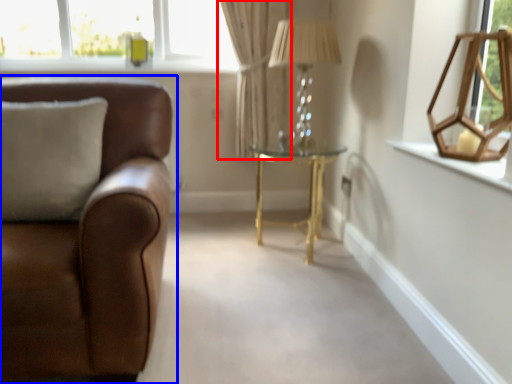
Question: Which object appears closest to the camera in this image, curtain (highlighted by a red box) or studio couch (highlighted by a blue box)?

Choices:
 (A) curtain
 (B) studio couch

Answer: (B)